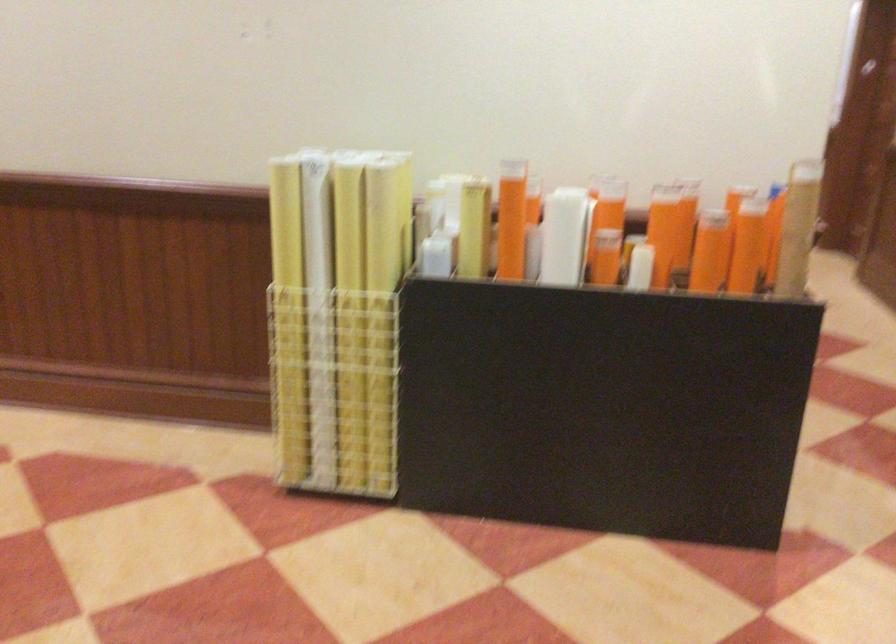
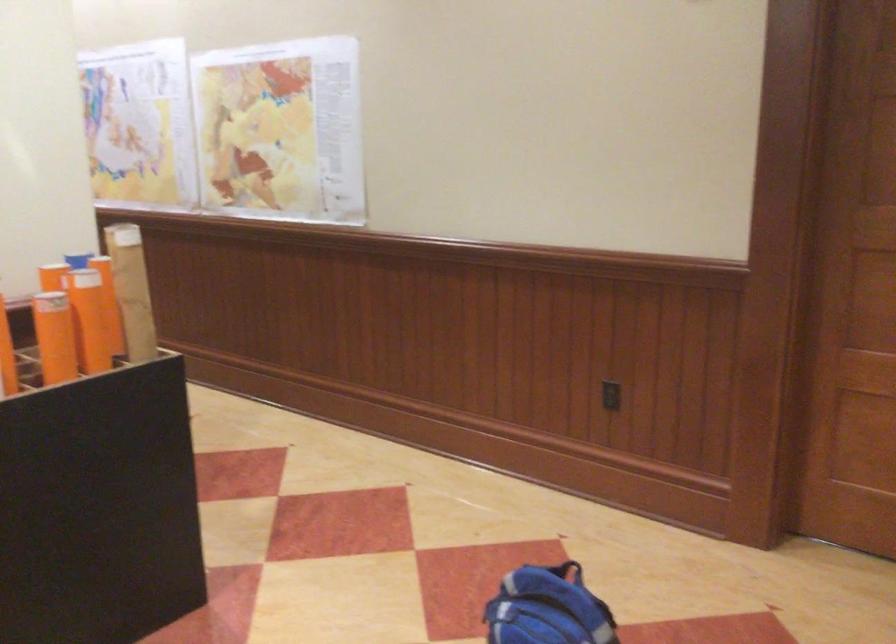
The point at (776, 223) is marked in the first image. Where is the corresponding point in the second image?

(132, 290)